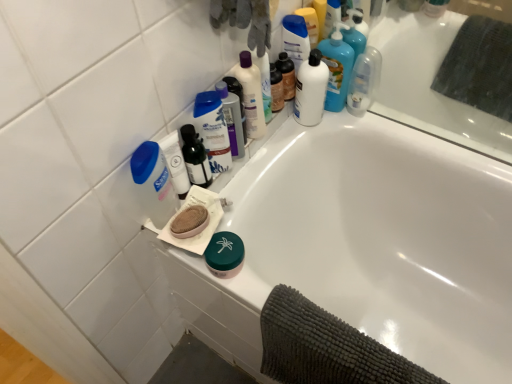
This screenshot has height=384, width=512. In order to click on free space above dark gray textured towel at lower right (from a real-world perspective) in this screenshot , I will do `click(338, 342)`.